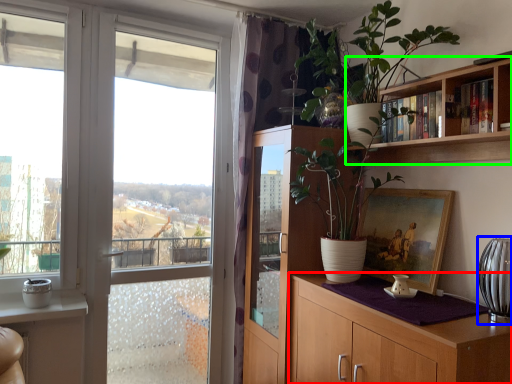
Question: Which is nearer to the cabinetry (highlighted by a red box)? glass vase (highlighted by a blue box) or bookcase (highlighted by a green box).

Choices:
 (A) glass vase
 (B) bookcase

Answer: (A)